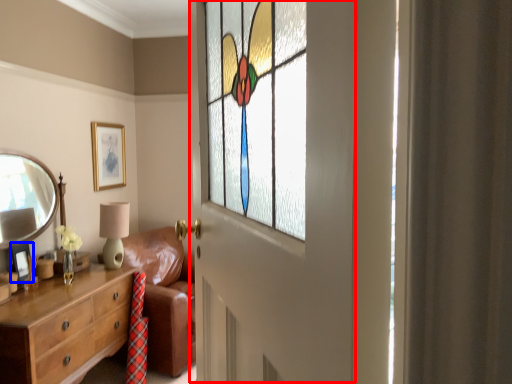
Question: Which object appears closest to the camera in this image, screen door (highlighted by a red box) or picture frame (highlighted by a blue box)?

Choices:
 (A) screen door
 (B) picture frame

Answer: (A)